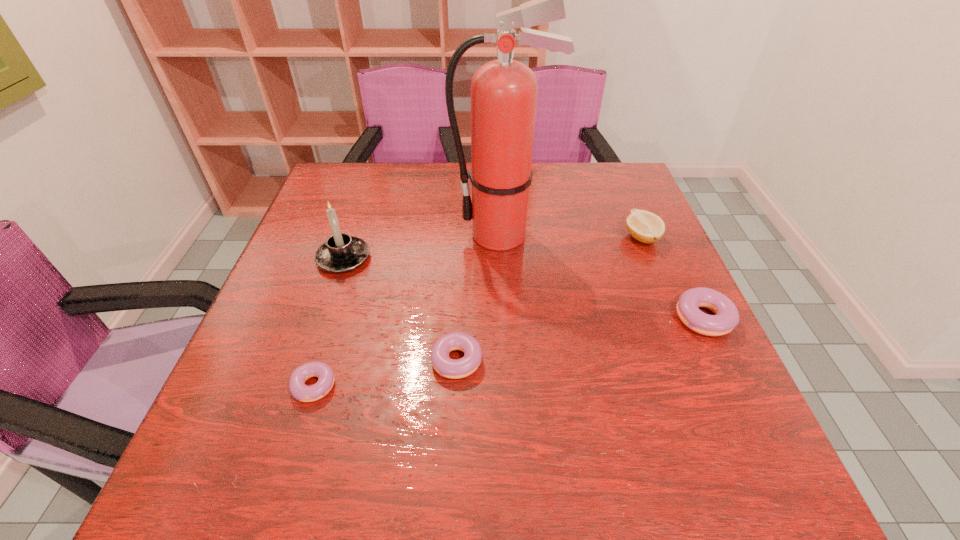
Image resolution: width=960 pixels, height=540 pixels. Identify the location of the shortest object. (300, 391).

You are a GUI agent. You are given a task and a screenshot of the screen. Output one action in this format:
    pyautogui.click(x=<x>, y=<y>)
    Task: Click on the shortest doughnut
    
    Given the screenshot: What is the action you would take?
    pyautogui.click(x=300, y=391)

This screenshot has height=540, width=960. In order to click on the second shortest object in this screenshot , I will do `click(450, 368)`.

The image size is (960, 540). In order to click on the second tallest doughnut in this screenshot , I will do `click(450, 368)`.

Locate an element on the screen. The image size is (960, 540). the third shortest object is located at coordinates (726, 317).

Where is `the tallest doughnut`? This screenshot has height=540, width=960. the tallest doughnut is located at coordinates point(726,317).

Where is `the tallest object`? the tallest object is located at coordinates (504, 91).

Locate an element on the screen. The height and width of the screenshot is (540, 960). candle holder is located at coordinates (341, 253).

The width and height of the screenshot is (960, 540). I want to click on lemon, so click(644, 226).

You are a GUI agent. You are given a task and a screenshot of the screen. Output one action in this format:
    pyautogui.click(x=<x>, y=<y>)
    Task: Click on the free region located 0.380m on the right of the shortest object
    This screenshot has height=540, width=960.
    Given the screenshot: What is the action you would take?
    pyautogui.click(x=543, y=385)